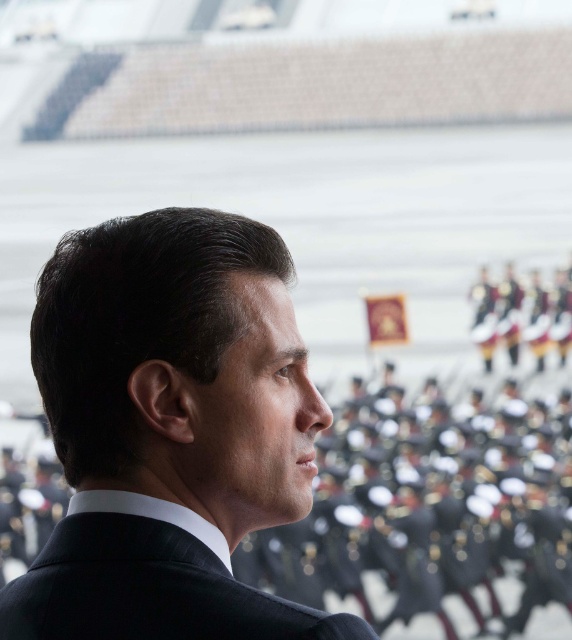
Who is positioned more to the right, black silk suit at center or black pinstripe suit at center?

black pinstripe suit at center

This screenshot has height=640, width=572. What do you see at coordinates (170, 432) in the screenshot?
I see `black silk suit at center` at bounding box center [170, 432].

Identify the location of black silk suit at center. (170, 432).